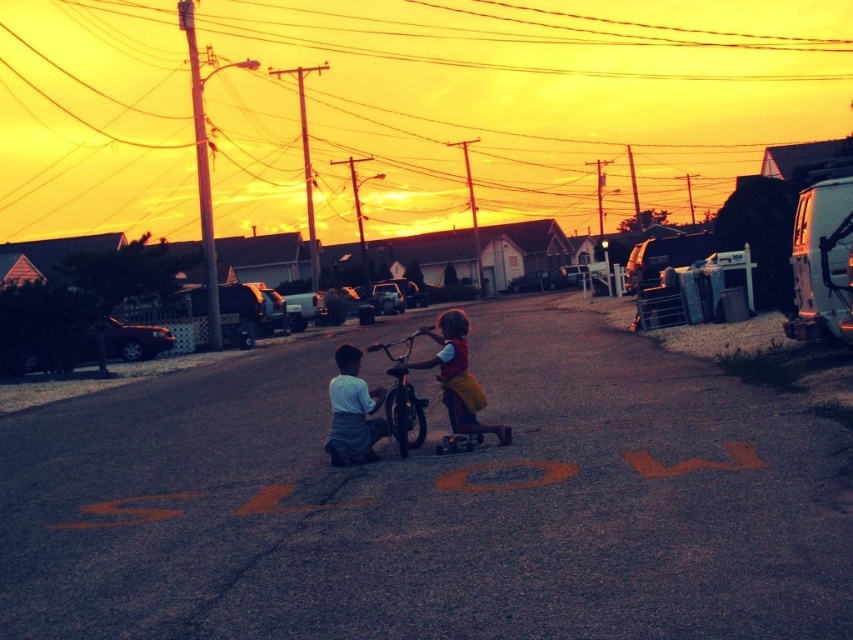
Question: From the image, what is the correct spatial relationship of matte yellow shorts at center in relation to matte white shirt at center?

Choices:
 (A) right
 (B) left

Answer: (A)

Question: Estimate the real-world distances between objects in this image. Which object is farther from the matte white shirt at center?

Choices:
 (A) matte yellow shorts at center
 (B) metallic silver bicycle at center

Answer: (B)

Question: Does matte yellow shorts at center come behind matte white shirt at center?

Choices:
 (A) no
 (B) yes

Answer: (B)

Question: Which is farther from the metallic silver bicycle at center?

Choices:
 (A) matte yellow shorts at center
 (B) matte white shirt at center

Answer: (B)

Question: Is matte yellow shorts at center wider than metallic silver bicycle at center?

Choices:
 (A) yes
 (B) no

Answer: (B)

Question: Which of the following is the farthest from the observer?

Choices:
 (A) metallic silver bicycle at center
 (B) matte yellow shorts at center
 (C) matte white shirt at center

Answer: (B)